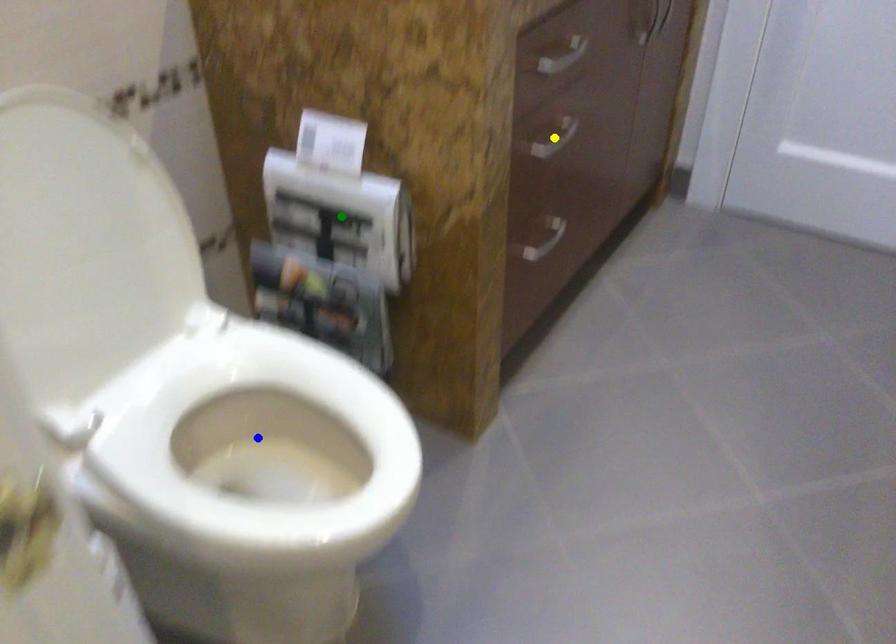
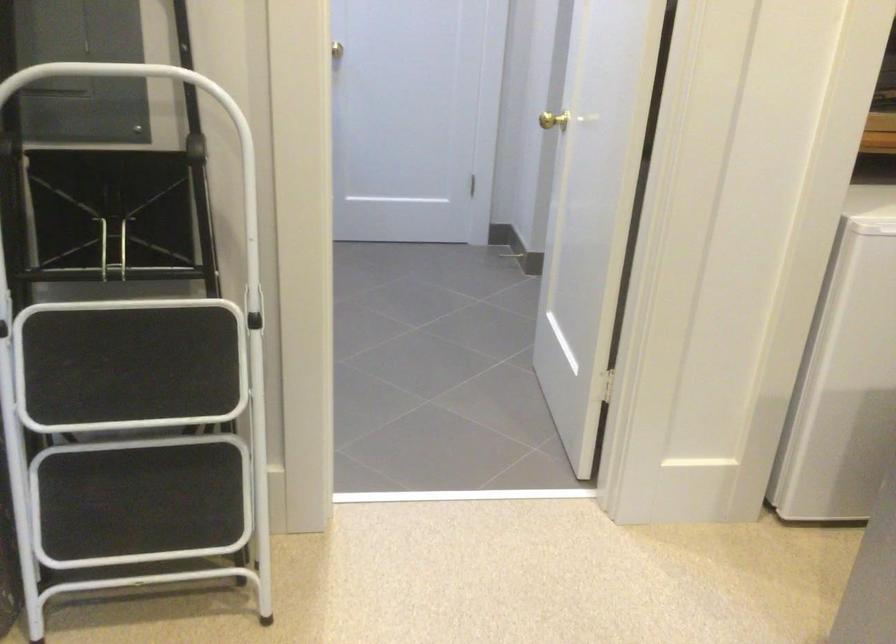
I am providing you with two images of the same scene from different viewpoints. Three points are marked in image1. Which point corresponds to a part or object that is occluded in image2?In image1, three points are marked. Which of them correspond to a part or object that is occluded in image2?Among the three points shown in image1, which one corresponds to a part or object that is no longer visible due to occlusion in image2?

Invisible in image2: blue point, green point, yellow point.